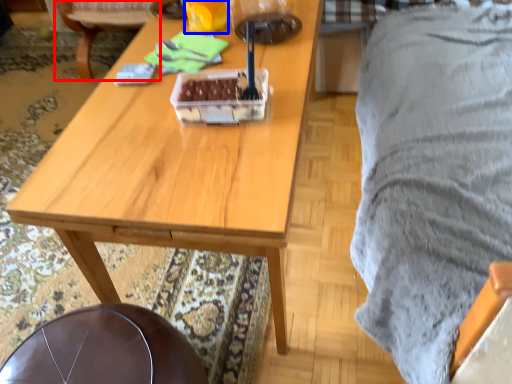
Question: Which of the following is the closest to the observer, chair (highlighted by a red box) or coffee cup (highlighted by a blue box)?

Choices:
 (A) chair
 (B) coffee cup

Answer: (B)